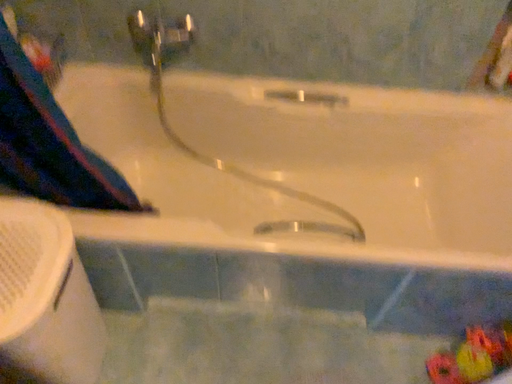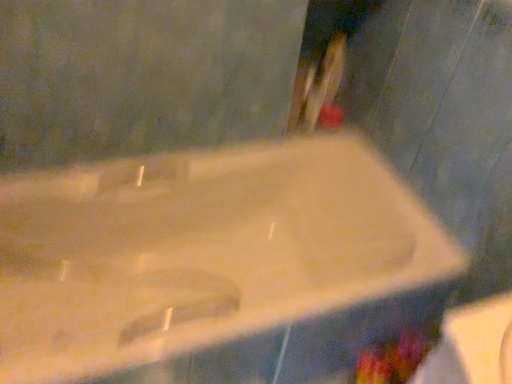
Question: Which way did the camera rotate in the video?

Choices:
 (A) rotated upward
 (B) rotated downward

Answer: (A)